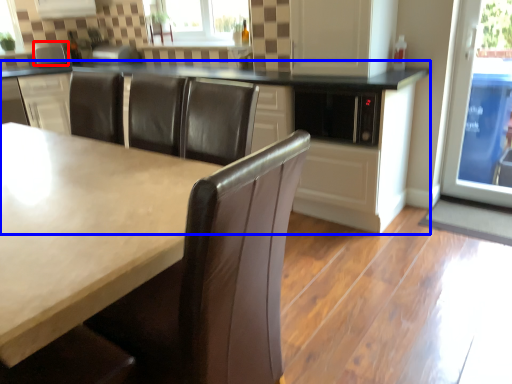
Question: Which point is closer to the camera, appliance (highlighted by a red box) or cabinetry (highlighted by a blue box)?

Choices:
 (A) appliance
 (B) cabinetry

Answer: (B)